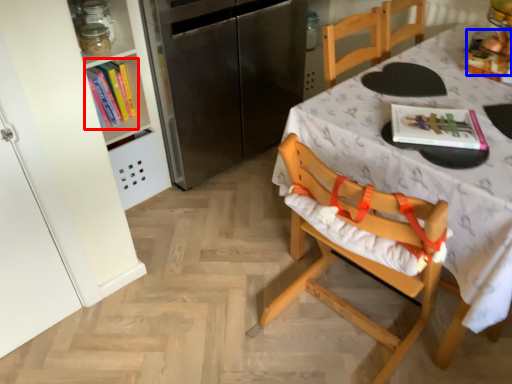
Question: Among these objects, which one is nearest to the camera, book (highlighted by a red box) or food (highlighted by a blue box)?

Choices:
 (A) book
 (B) food

Answer: (B)